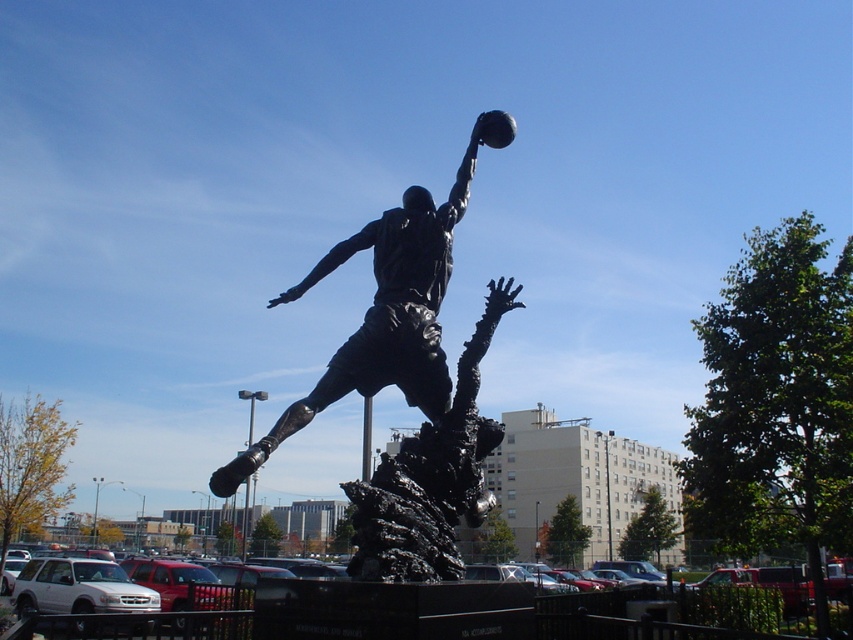
You are a city planner assessing the statue placement. The bronze statue at center is planned to be placed in the black asphalt parking lot at center. Considering their heights, will the statue be visible from the adjacent buildings? Please explain.

The bronze statue at center is not as tall as the black asphalt parking lot at center. Since the statue is shorter than the parking lot, it will be visible from the adjacent buildings as it won not be obscured by the parking lot height.

You are standing in front of the bronze statue at center and the black asphalt parking lot at center. Which object is closer to you?

The bronze statue at center is closer to you than the black asphalt parking lot at center.

You are standing at the base of the bronze statue of the basketball player. You see two points marked on the statue. The first point is at coordinate point (442, 518) and the second is at point (64, 637). If you were to walk towards the statue, which point would you encounter first?

Point (442, 518) is in front of point (64, 637), so you would encounter point (442, 518) first when approaching the statue.